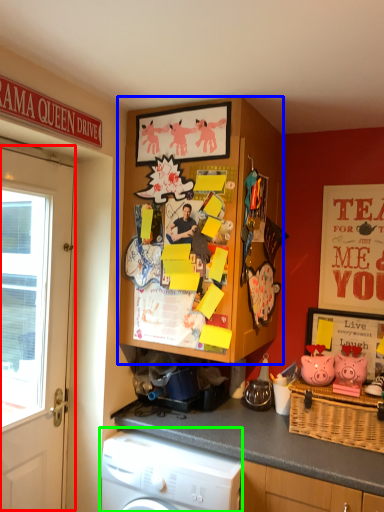
Question: Which object is the farthest from door (highlighted by a red box)? Choose among these: cabinetry (highlighted by a blue box) or washing machine (highlighted by a green box).

Choices:
 (A) cabinetry
 (B) washing machine

Answer: (A)